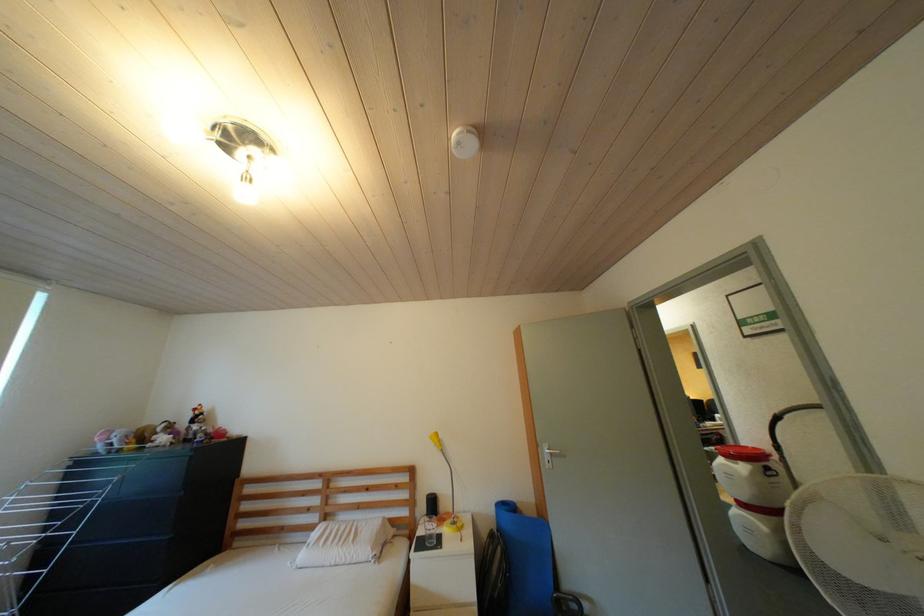
Where would you lift the yellow desk lamp? Please return your answer as a coordinate pair (x, y).

(447, 488)